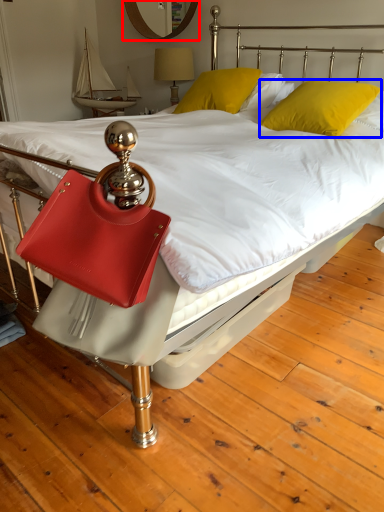
Question: Among these objects, which one is farthest to the camera, mirror (highlighted by a red box) or pillow (highlighted by a blue box)?

Choices:
 (A) mirror
 (B) pillow

Answer: (A)